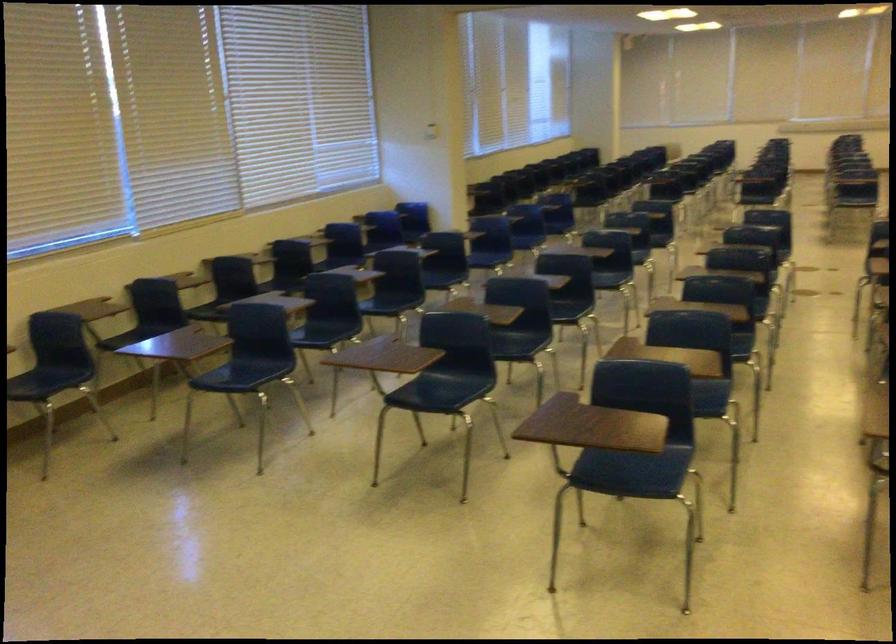
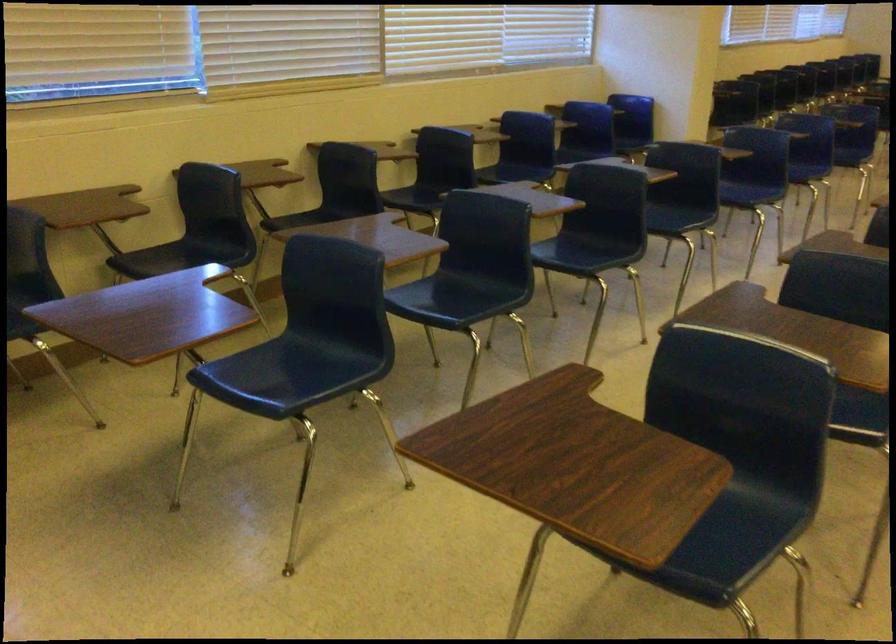
The point at (x=135, y=335) is marked in the first image. Where is the corresponding point in the second image?

(181, 257)